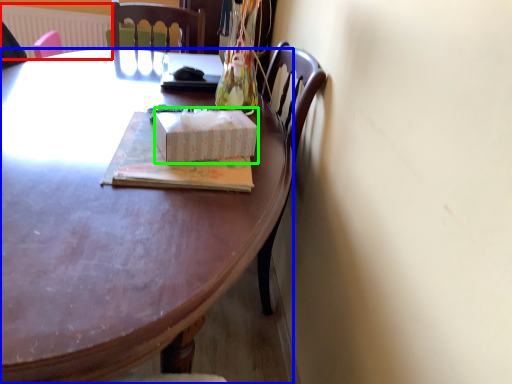
Question: Considering the real-world distances, which object is closest to radiator (highlighted by a red box)? desk (highlighted by a blue box) or box (highlighted by a green box).

Choices:
 (A) desk
 (B) box

Answer: (A)